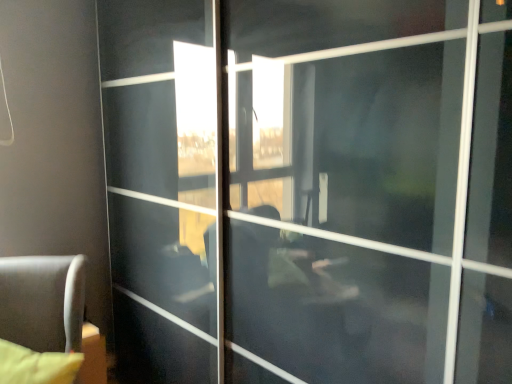
This screenshot has width=512, height=384. Describe the element at coordinates (42, 301) in the screenshot. I see `matte gray chair at lower left` at that location.

Locate an element on the screen. This screenshot has height=384, width=512. matte gray chair at lower left is located at coordinates (42, 301).

I want to click on matte gray chair at lower left, so click(x=42, y=301).